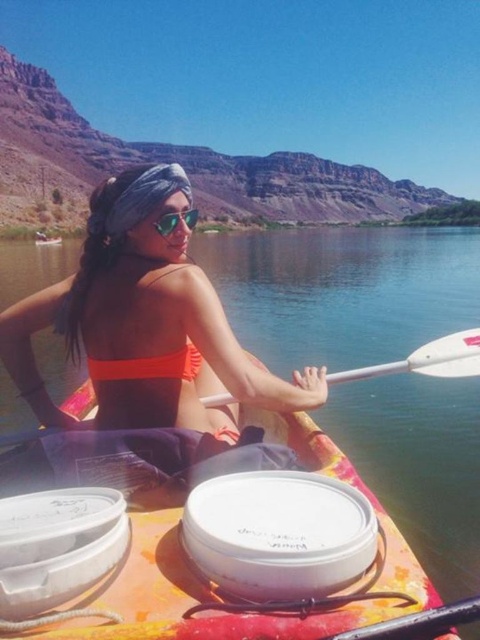
You are a photographer planning to take a photo of the clear water at center and the orange bikini top at upper center. The camera you have can only focus on objects within 100 feet of each other. Will both subjects be in focus?

The clear water at center and orange bikini top at upper center are 138.39 feet apart from each other, which exceeds the camera focus range of 100 feet. Therefore, both subjects cannot be in focus simultaneously.

You are a photographer planning to take a photo of the white plastic paddle at center and the orange fabric boat at center. Since you want to emphasize the paddle, which object should you focus on to ensure it appears larger in the photo?

The white plastic paddle at center has a larger size compared to the orange fabric boat at center, so focusing on the white plastic paddle at center will make it appear larger in the photo.